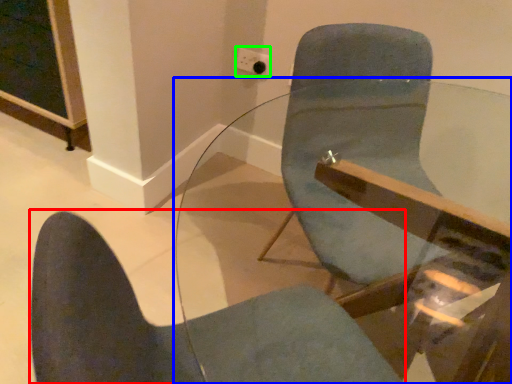
Question: Which object is the farthest from chair (highlighted by a red box)? Choose among these: table (highlighted by a blue box) or electric outlet (highlighted by a green box).

Choices:
 (A) table
 (B) electric outlet

Answer: (B)